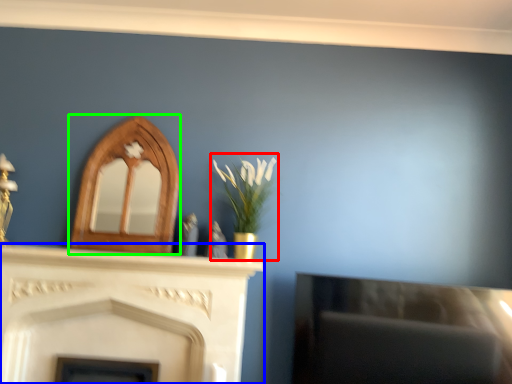
Question: Based on their relative distances, which object is nearer to floral arrangement (highlighted by a red box)? Choose from fireplace (highlighted by a blue box) and fireplace (highlighted by a green box).

Choices:
 (A) fireplace
 (B) fireplace

Answer: (B)